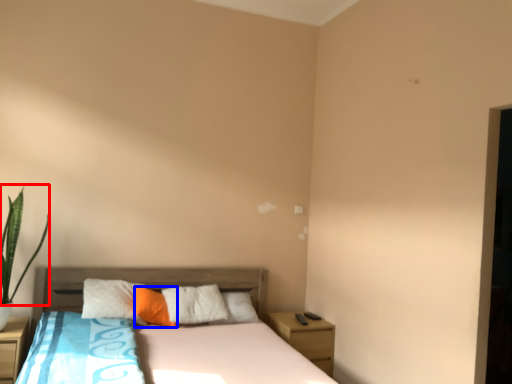
Question: Which of the following is the closest to the observer, plant (highlighted by a red box) or pillow (highlighted by a blue box)?

Choices:
 (A) plant
 (B) pillow

Answer: (A)